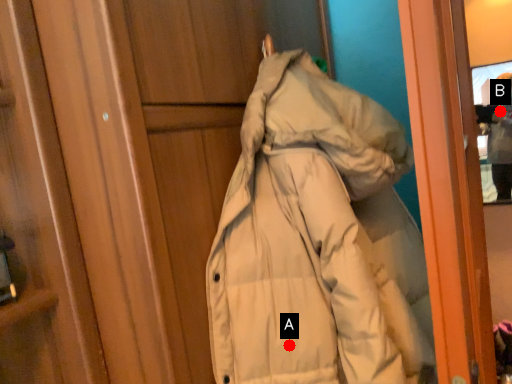
Question: Two points are circled on the image, labeled by A and B beside each circle. Which of the following is the closest to the observer?

Choices:
 (A) A is closer
 (B) B is closer

Answer: (A)